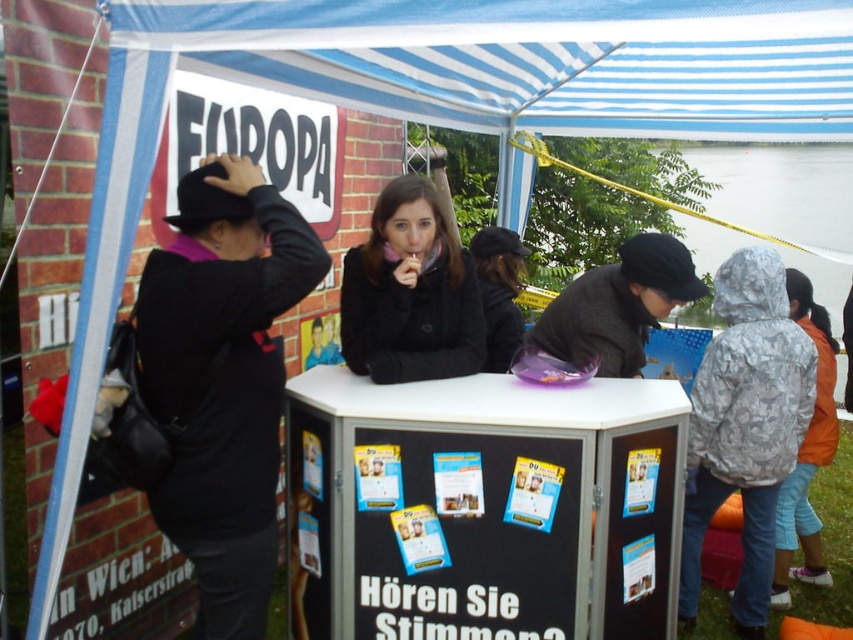
Question: Can you confirm if blue striped canopy at upper center is positioned above black matte bowler hat at left?

Choices:
 (A) no
 (B) yes

Answer: (B)

Question: Which point appears closest to the camera in this image?

Choices:
 (A) (421, 22)
 (B) (520, 280)
 (C) (776, 561)

Answer: (A)

Question: Which point is farther from the camera taking this photo?

Choices:
 (A) (488, 324)
 (B) (405, 13)
 (C) (372, 282)

Answer: (A)

Question: Is black plastic table at center positioned before orange fabric jacket at right?

Choices:
 (A) yes
 (B) no

Answer: (A)

Question: Which of the following is the farthest from the observer?

Choices:
 (A) blue striped canopy at upper center
 (B) camouflage-patterned jacket at lower right
 (C) black fabric cap at center
 (D) black matte bowler hat at left

Answer: (C)

Question: Can you confirm if black plastic table at center is positioned to the left of camouflage-patterned jacket at lower right?

Choices:
 (A) yes
 (B) no

Answer: (A)